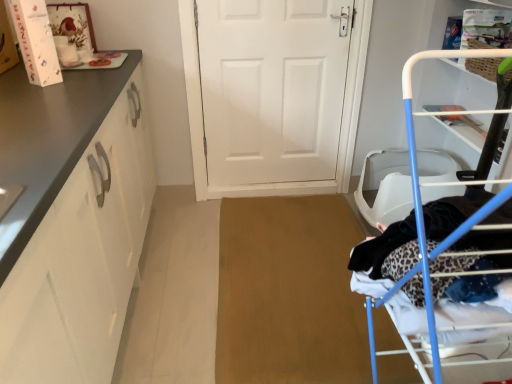
Question: From a real-world perspective, is blue metal drying rack at right positioned above or below matte white cabinet at left?

Choices:
 (A) above
 (B) below

Answer: (A)

Question: In terms of size, does blue metal drying rack at right appear bigger or smaller than matte white cabinet at left?

Choices:
 (A) small
 (B) big

Answer: (A)

Question: Which is farther from the white matte door at center?

Choices:
 (A) blue metal drying rack at right
 (B) matte white cabinet at left

Answer: (A)

Question: Based on their relative distances, which object is farther from the white matte door at center?

Choices:
 (A) matte white cabinet at left
 (B) blue metal drying rack at right

Answer: (B)